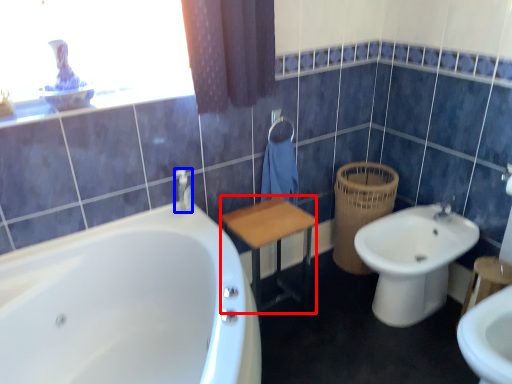
Question: Which of the following is the closest to the observer, vanity (highlighted by a red box) or toiletry (highlighted by a blue box)?

Choices:
 (A) vanity
 (B) toiletry

Answer: (A)